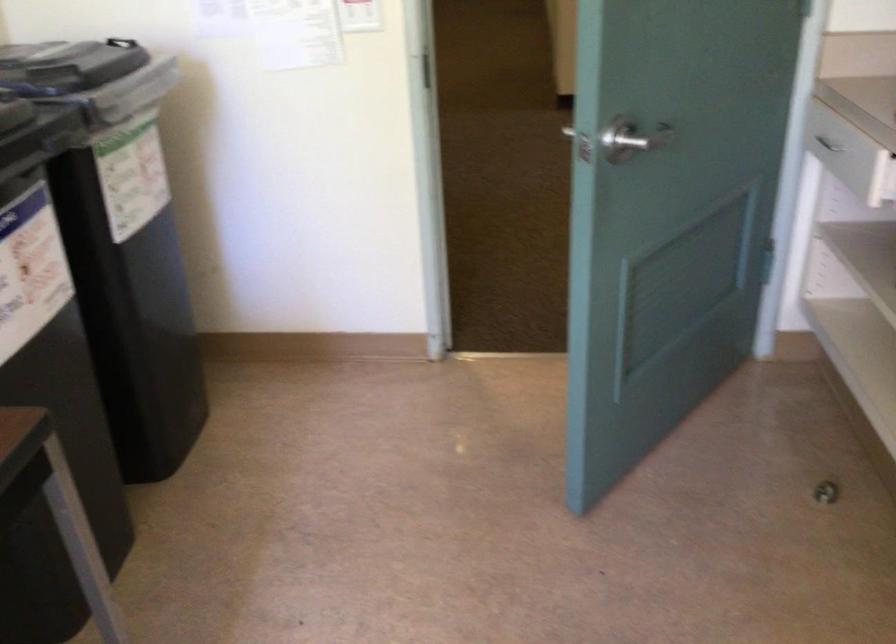
This screenshot has height=644, width=896. In order to click on silver door handle in this screenshot , I will do `click(633, 138)`.